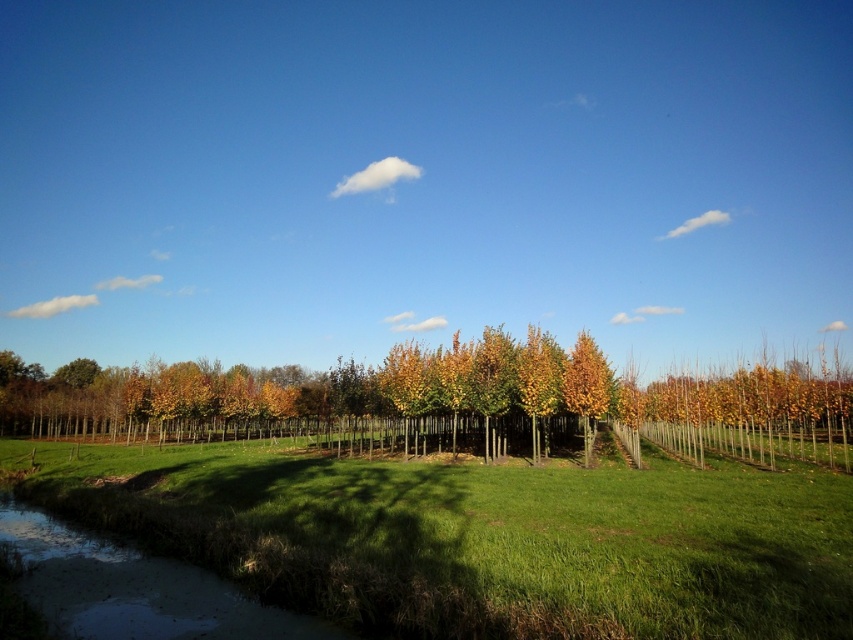
You are standing in the middle of the green grass at center and want to pick up the golden yellow leaves at center. Which direction should you move to reach them?

Since the green grass at center is above the golden yellow leaves at center, you should move downward to reach them.

You are standing at the point marked as point A located at coordinates 0.654, 0.432. You want to walk towards the green grass at center. In which direction should you move relative to your current position?

→ You should move northeast to reach the green grass at center from your current position at point A.